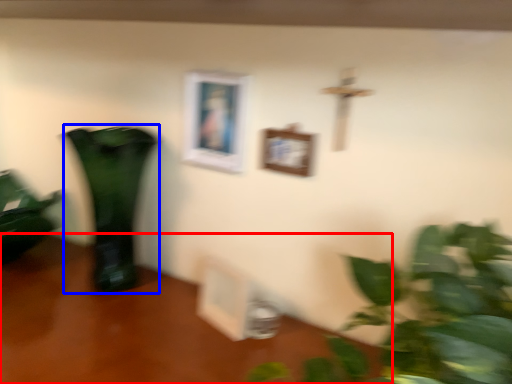
Question: Among these objects, which one is farthest to the camera, table (highlighted by a red box) or vase (highlighted by a blue box)?

Choices:
 (A) table
 (B) vase

Answer: (B)